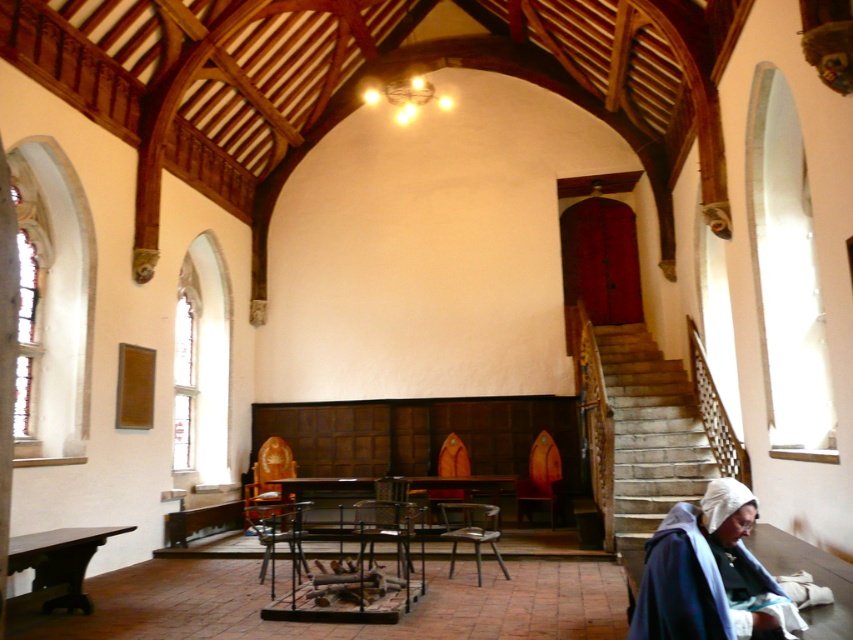
You are an architect visiting this historic building and need to place a large sculpture that requires a space larger than the wooden table at center. Can the wooden staircase at right accommodate the sculpture?

The wooden staircase at right is bigger than the wooden table at center, so it can accommodate the sculpture.

From the picture: You are standing at the entrance of this historic building and notice both the wooden staircase at right and the dark blue woolen robe at lower right. Which object is positioned further to the right from your viewpoint?

The wooden staircase at right is positioned further to the right than the dark blue woolen robe at lower right.